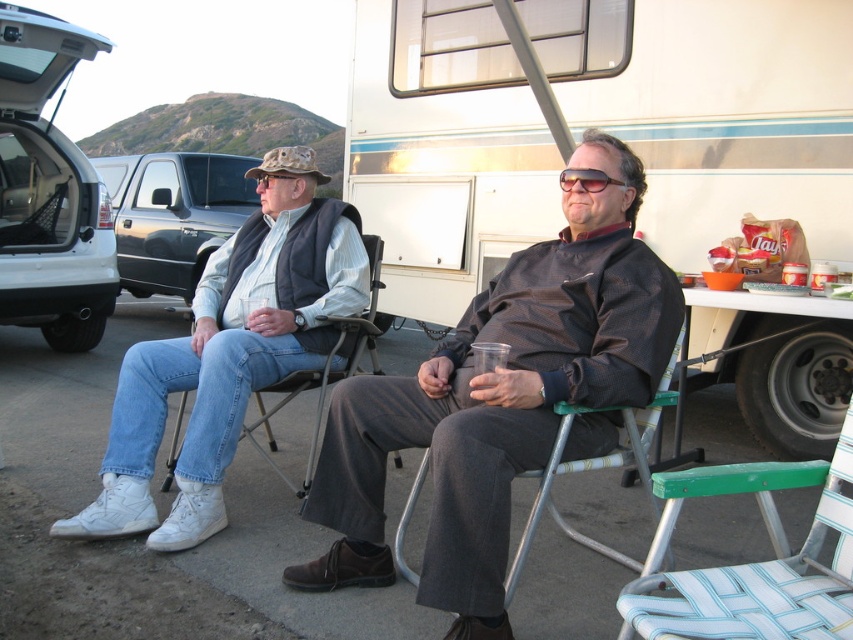
From the picture: Based on the scene description, can you determine which object is bigger between the white vinyl recreational vehicle at center and the green woven fabric folding chair at lower right?

The white vinyl recreational vehicle at center is larger in size than the green woven fabric folding chair at lower right.

Consider the image. You are standing at the origin point in the image. There is a white leather shoes at lower left located at point (229, 353). Can you determine the direction of the white leather shoes at lower left relative to your position?

The white leather shoes at lower left is located at point (229, 353), which is to the lower left direction from the origin point.

Looking at this image, you are a photographer setting up a tripod to take a group photo of the two people. The white leather shoes at lower left and the green woven fabric folding chair at lower right are in the scene. Which object should you focus on first to ensure both subjects are in sharp focus?

You should focus on the white leather shoes at lower left first because it is closer to you than the green woven fabric folding chair at lower right, ensuring both will be in focus when focused on the closer object.